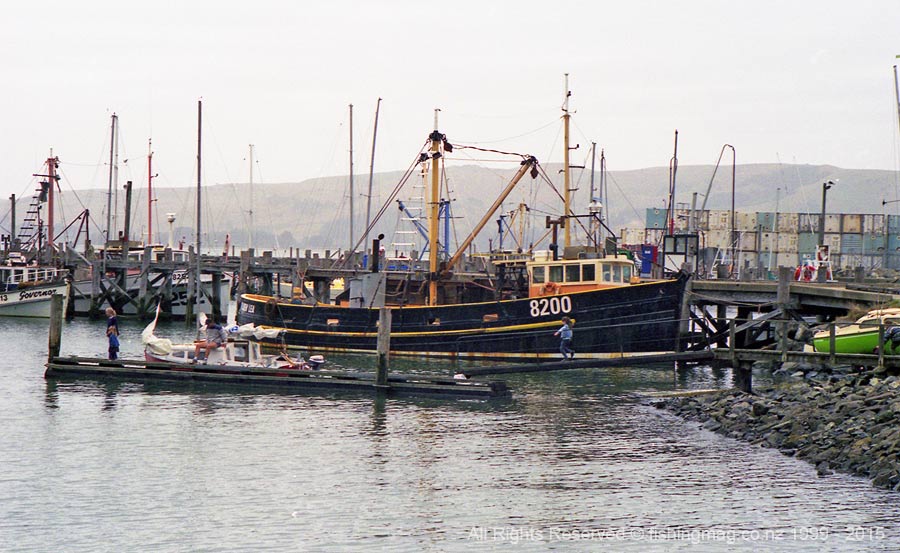
At what (x,y) coordinates should I click in order to perform the action: click on storage unit. Please return your answer as a coordinate pair (x, y). Looking at the image, I should click on (856, 234).